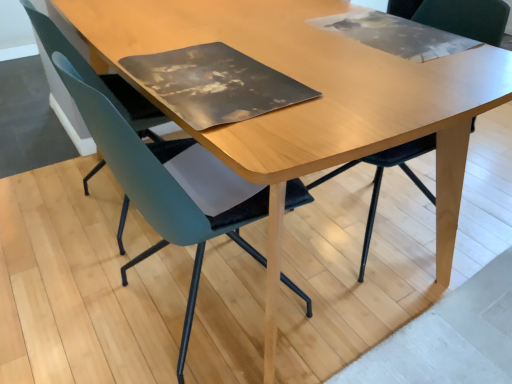
Question: From the image's perspective, is teal matte chair at left, the third chair viewed from the right, located above matte black chair at center, the 3th chair in the left-to-right sequence?

Choices:
 (A) yes
 (B) no

Answer: (A)

Question: Is teal matte chair at left, the 1th chair in the left-to-right sequence, positioned before matte black chair at center, the first chair positioned from the right?

Choices:
 (A) yes
 (B) no

Answer: (B)

Question: Is teal matte chair at left, the 1th chair in the left-to-right sequence, placed right next to matte black chair at center, the first chair positioned from the right?

Choices:
 (A) no
 (B) yes

Answer: (A)

Question: Is teal matte chair at left, the 1th chair in the left-to-right sequence, thinner than matte black chair at center, the first chair positioned from the right?

Choices:
 (A) no
 (B) yes

Answer: (A)

Question: Is teal matte chair at left, the third chair viewed from the right, bigger than matte black chair at center, the 3th chair in the left-to-right sequence?

Choices:
 (A) no
 (B) yes

Answer: (B)

Question: Is teal matte chair at left, the third chair viewed from the right, positioned far away from matte black chair at center, the 3th chair in the left-to-right sequence?

Choices:
 (A) yes
 (B) no

Answer: (A)

Question: Considering the relative positions of matte black chair at center, the 3th chair in the left-to-right sequence, and teal matte chair at left, the 1th chair in the left-to-right sequence, in the image provided, is matte black chair at center, the 3th chair in the left-to-right sequence, to the left of teal matte chair at left, the 1th chair in the left-to-right sequence, from the viewer's perspective?

Choices:
 (A) no
 (B) yes

Answer: (A)

Question: Is matte black chair at center, the 3th chair in the left-to-right sequence, taller than teal matte chair at left, the third chair viewed from the right?

Choices:
 (A) no
 (B) yes

Answer: (B)

Question: From a real-world perspective, is matte black chair at center, the 3th chair in the left-to-right sequence, positioned over teal matte chair at left, the third chair viewed from the right, based on gravity?

Choices:
 (A) no
 (B) yes

Answer: (B)

Question: Does matte black chair at center, the 3th chair in the left-to-right sequence, appear on the right side of teal matte chair at left, the third chair viewed from the right?

Choices:
 (A) yes
 (B) no

Answer: (A)

Question: Does matte black chair at center, the first chair positioned from the right, have a lesser height compared to teal matte chair at left, the third chair viewed from the right?

Choices:
 (A) yes
 (B) no

Answer: (B)

Question: Is matte black chair at center, the first chair positioned from the right, bigger than teal matte chair at left, the third chair viewed from the right?

Choices:
 (A) no
 (B) yes

Answer: (A)

Question: Does teal fabric chair at center, arranged as the second chair when viewed from the right, have a greater width compared to light wood table at center?

Choices:
 (A) no
 (B) yes

Answer: (A)